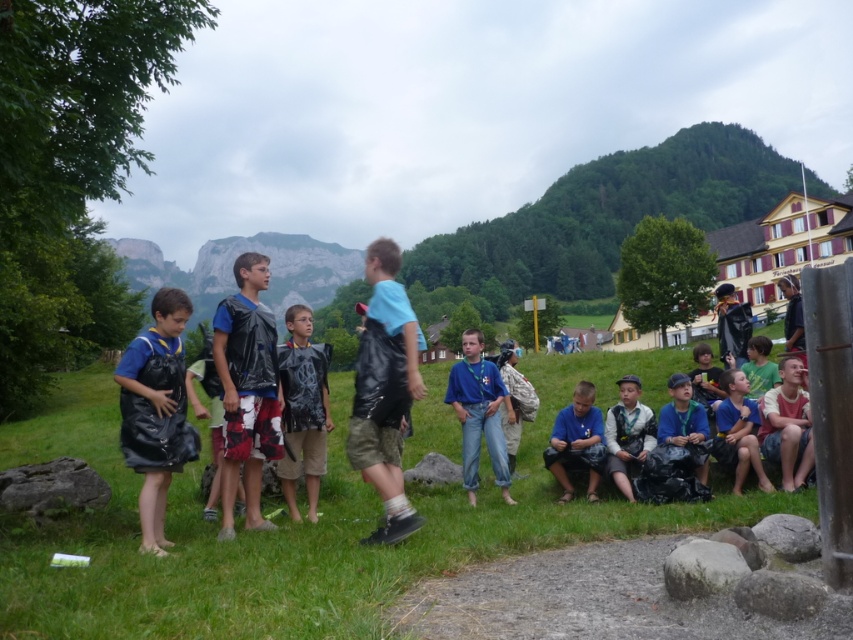
Question: Is blue denim jeans at center bigger than blue matte shirt at lower center?

Choices:
 (A) no
 (B) yes

Answer: (B)

Question: Among these points, which one is farthest from the camera?

Choices:
 (A) (662, 438)
 (B) (622, 205)

Answer: (B)

Question: Considering the real-world distances, which object is farthest from the green forested mountain at upper center?

Choices:
 (A) white cotton shirt at lower right
 (B) black matte vest at center
 (C) black plastic vest at center
 (D) blue matte shirt at lower center

Answer: (B)

Question: Does green forested mountain at upper center have a smaller size compared to rugged stone mountain at upper center?

Choices:
 (A) yes
 (B) no

Answer: (B)

Question: Does black plastic vest at center have a larger size compared to white cotton shirt at center?

Choices:
 (A) yes
 (B) no

Answer: (A)

Question: Which object is positioned closest to the white cotton shirt at lower right?

Choices:
 (A) green forested mountain at upper center
 (B) black matte vest at center
 (C) black plastic vest at center

Answer: (B)